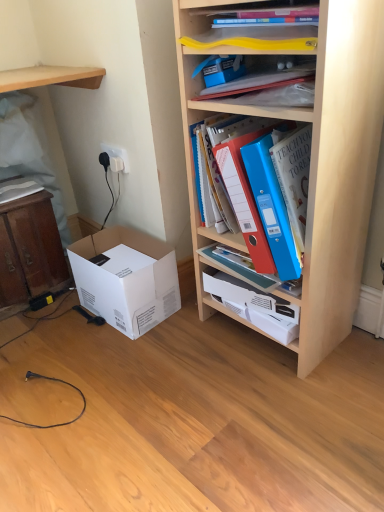
You are a GUI agent. You are given a task and a screenshot of the screen. Output one action in this format:
    pyautogui.click(x=<x>, y=<y>)
    Task: Click on the free space in front of wooden bookshelf at upper right, which is the 2th shelf from left to right
    The width and height of the screenshot is (384, 512).
    Given the screenshot: What is the action you would take?
    pyautogui.click(x=293, y=400)